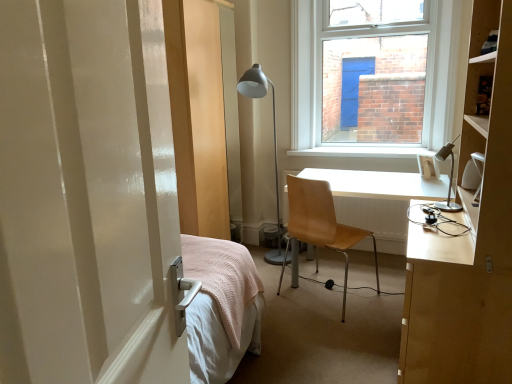
Identify the location of vacant space underneath light brown wood desk at center right (from a real-world perspective). (372, 280).